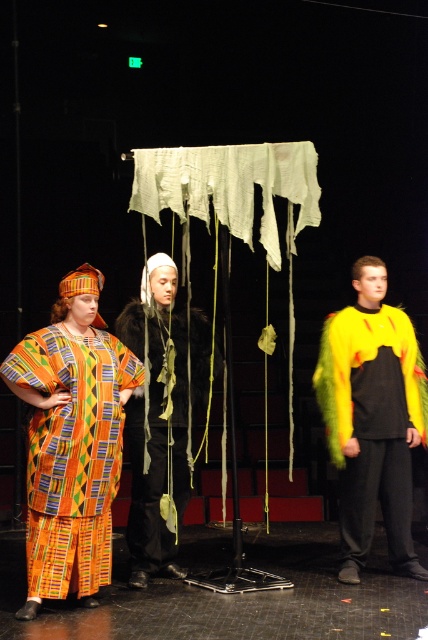
Question: Is multicolored woven fabric dress at left to the left of velvet black cape at center from the viewer's perspective?

Choices:
 (A) yes
 (B) no

Answer: (A)

Question: Which object is closer to the camera taking this photo?

Choices:
 (A) velvet black cape at center
 (B) fluorescent yellow fur vest at right
 (C) multicolored woven fabric dress at left

Answer: (C)

Question: Among these points, which one is farthest from the camera?

Choices:
 (A) (380, 340)
 (B) (136, 433)

Answer: (A)

Question: Is multicolored woven fabric dress at left below velvet black cape at center?

Choices:
 (A) yes
 (B) no

Answer: (A)

Question: Based on their relative distances, which object is farther from the fluorescent yellow fur vest at right?

Choices:
 (A) velvet black cape at center
 (B) multicolored woven fabric dress at left

Answer: (B)

Question: Is multicolored woven fabric dress at left positioned before fluorescent yellow fur vest at right?

Choices:
 (A) yes
 (B) no

Answer: (A)